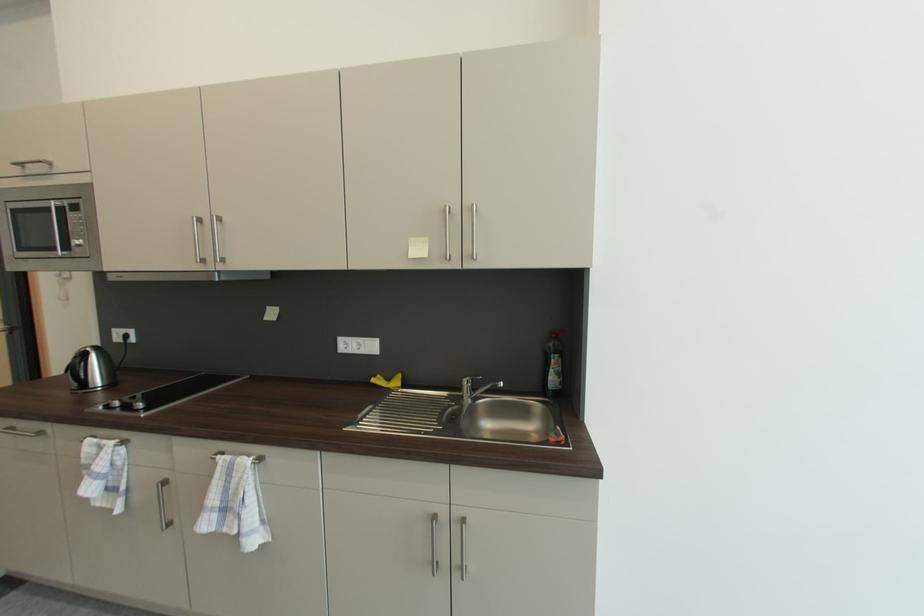
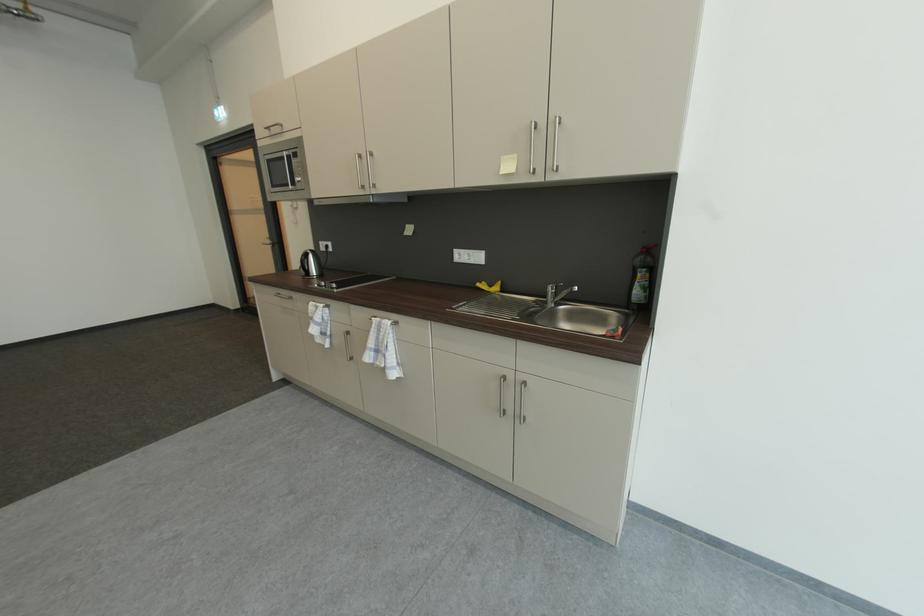
Find the pixel in the second image that matches (x=370, y=353) in the first image.

(479, 262)